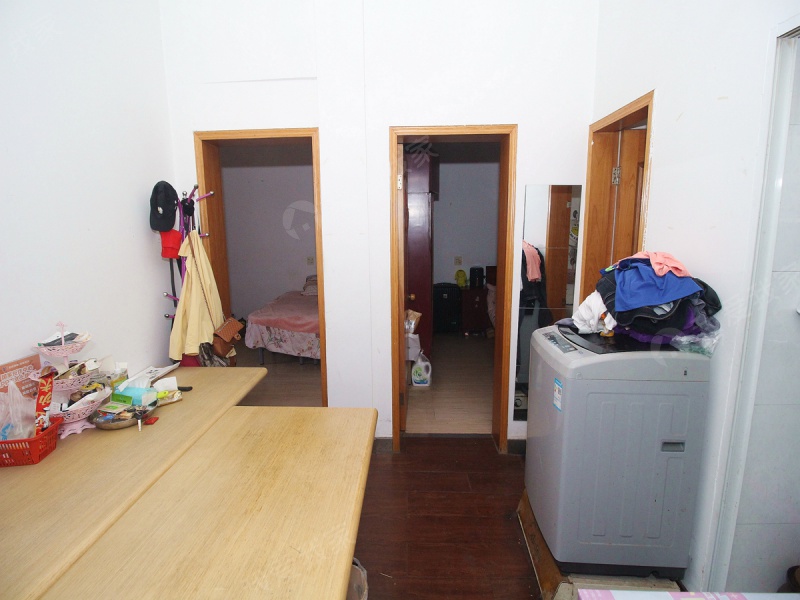
You are a GUI agent. You are given a task and a screenshot of the screen. Output one action in this format:
    pyautogui.click(x=<x>, y=<y>)
    Task: Click on the dark wooden floor
    Image resolution: width=800 pixels, height=600 pixels.
    Given the screenshot: What is the action you would take?
    pyautogui.click(x=482, y=513)